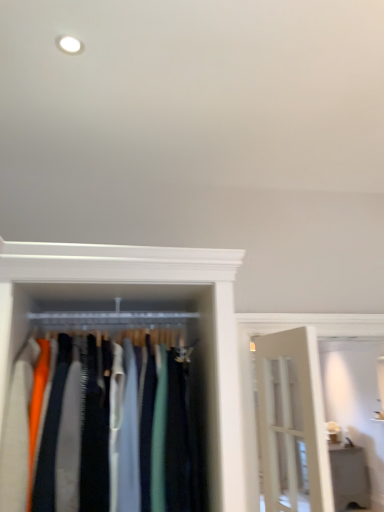
Question: Considering the positions of point (34, 246) and point (337, 459), is point (34, 246) closer or farther from the camera than point (337, 459)?

Choices:
 (A) closer
 (B) farther

Answer: (A)

Question: In terms of width, does matte fabric clothes at center look wider or thinner when compared to white glossy shelf at lower right?

Choices:
 (A) thin
 (B) wide

Answer: (B)

Question: From a real-world perspective, is matte fabric clothes at center above or below white glossy shelf at lower right?

Choices:
 (A) below
 (B) above

Answer: (B)

Question: Relative to matte fabric clothes at center, is white glossy shelf at lower right in front or behind?

Choices:
 (A) front
 (B) behind

Answer: (B)

Question: Does point (350, 464) appear closer or farther from the camera than point (3, 305)?

Choices:
 (A) farther
 (B) closer

Answer: (A)

Question: Looking at the image, does white glossy shelf at lower right seem bigger or smaller compared to matte fabric clothes at center?

Choices:
 (A) big
 (B) small

Answer: (A)

Question: From a real-world perspective, is white glossy shelf at lower right positioned above or below matte fabric clothes at center?

Choices:
 (A) below
 (B) above

Answer: (A)